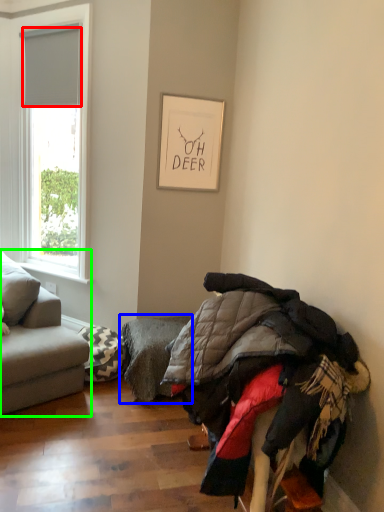
Question: Which is farther away from blind (highlighted by a red box)? footrest (highlighted by a blue box) or studio couch (highlighted by a green box)?

Choices:
 (A) footrest
 (B) studio couch

Answer: (A)